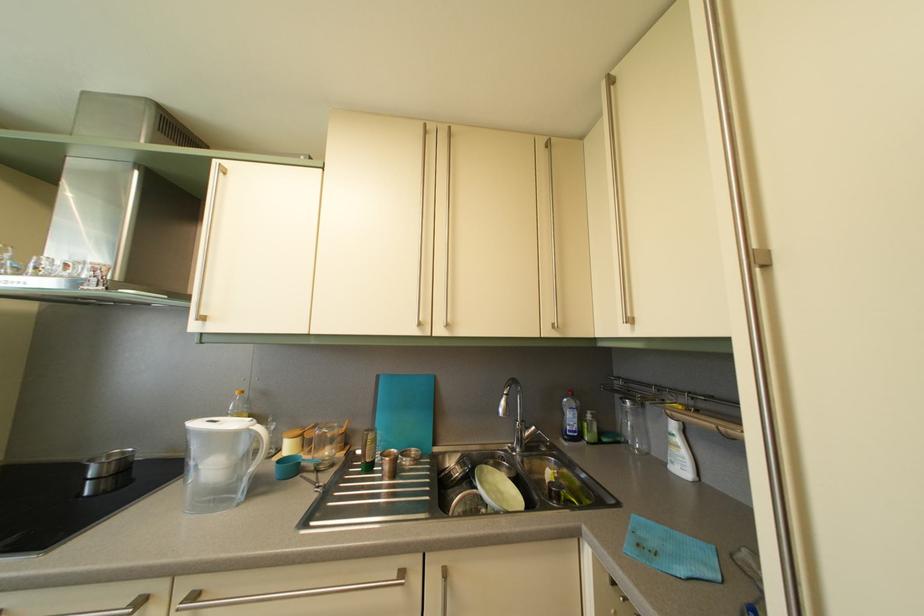
This screenshot has width=924, height=616. Describe the element at coordinates (293, 432) in the screenshot. I see `the wooden jar lid` at that location.